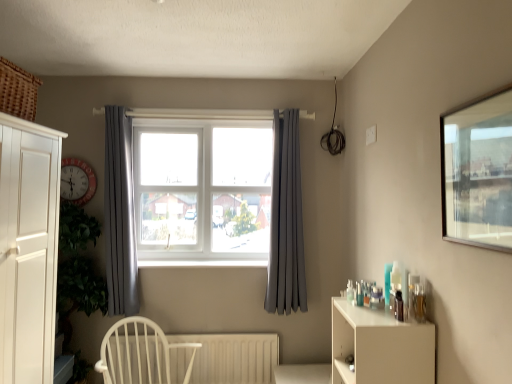
You are a GUI agent. You are given a task and a screenshot of the screen. Output one action in this format:
    pyautogui.click(x=<x>, y=<y>)
    Task: Click on the blank space above white plastic radiator at lower center (from a real-world perspective)
    The image size is (512, 384).
    Given the screenshot: What is the action you would take?
    pyautogui.click(x=203, y=326)